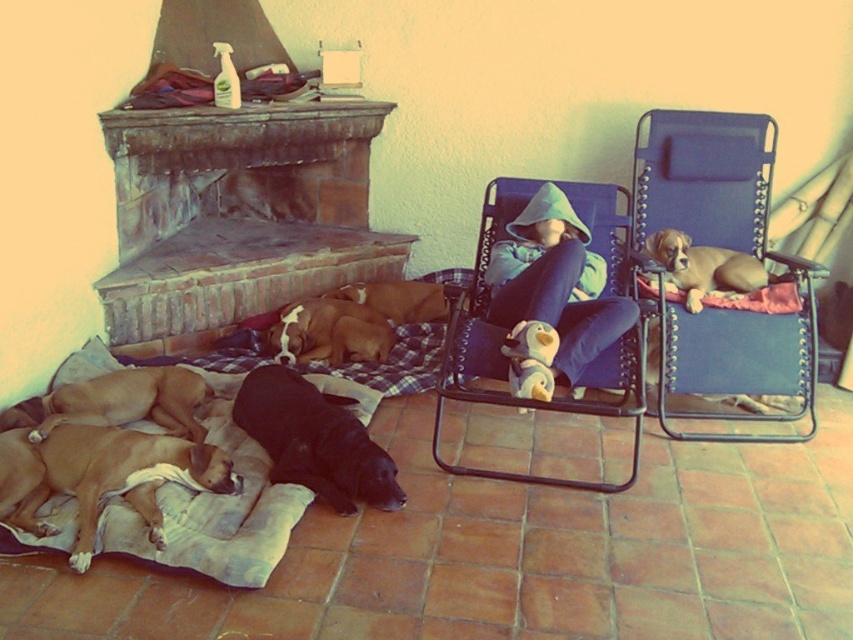
Consider the image. You are standing in the living room and want to move from the brick fireplace at upper left to the green fleece hoodie at center. Which direction should you move towards?

The brick fireplace at upper left is to the left of the green fleece hoodie at center, so you should move towards the right to reach the green fleece hoodie at center.

You are designing a layout for a living room and need to place a new sofa. The sofa will be placed near the brick fireplace at upper left and the green fleece hoodie at center. Which object should the sofa be closer to if you want it to be near the larger one?

The sofa should be placed closer to the brick fireplace at upper left because it has a larger size compared to the green fleece hoodie at center.

You are a photographer trying to capture a closeup of the brown fur at center and the brown fur dog at center. Since you want both subjects in focus, you need to know their relative positions. Which one is located to the left of the other?

The brown fur at center is positioned on the left side of brown fur dog at center.